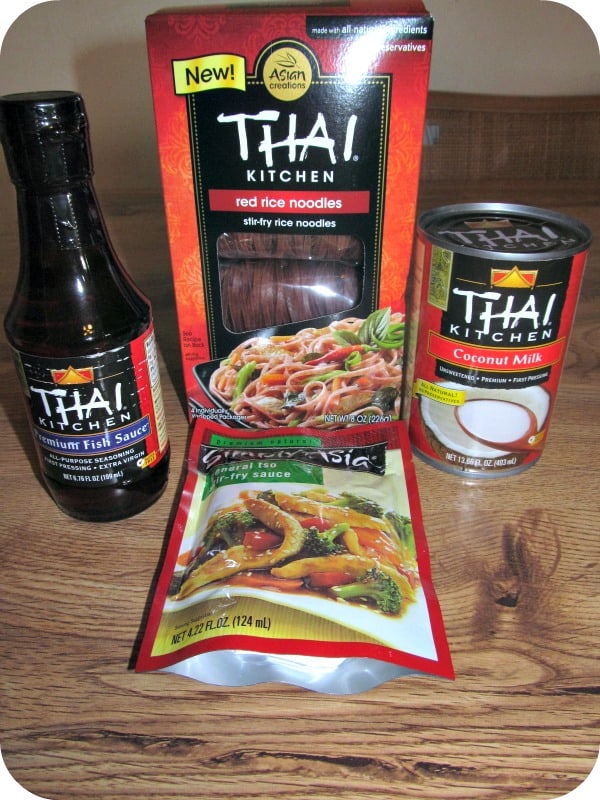
At what (x,y) coordinates should I click in order to perform the action: click on table. Please return your answer as a coordinate pair (x, y). The image size is (600, 800). Looking at the image, I should click on (99, 592).